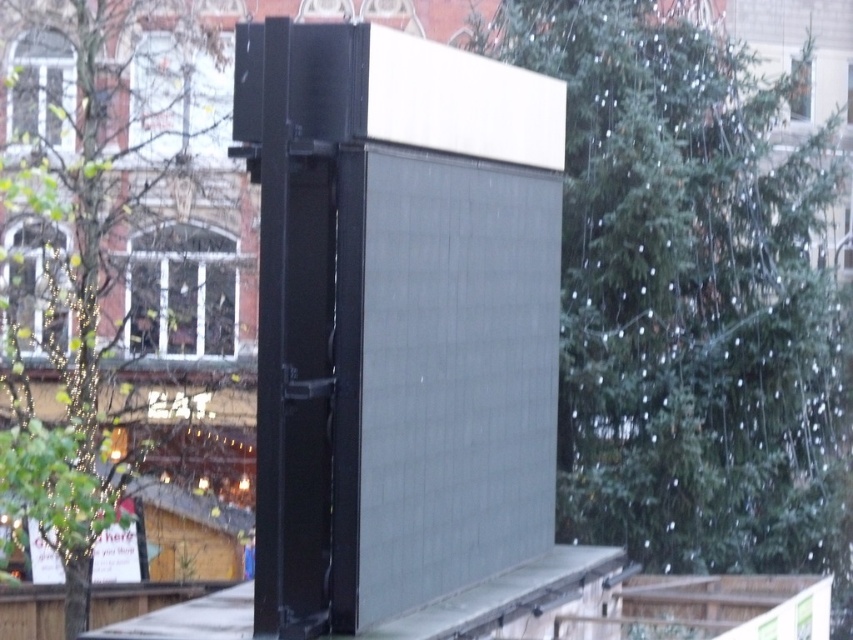
Question: Can you confirm if green textured tree at center is thinner than green leafy tree at left?

Choices:
 (A) no
 (B) yes

Answer: (A)

Question: Which object appears farthest from the camera in this image?

Choices:
 (A) green textured tree at center
 (B) green leafy tree at left

Answer: (A)

Question: Does green textured tree at center appear on the right side of green leafy tree at left?

Choices:
 (A) yes
 (B) no

Answer: (A)

Question: Is green textured tree at center closer to the viewer compared to green leafy tree at left?

Choices:
 (A) yes
 (B) no

Answer: (B)